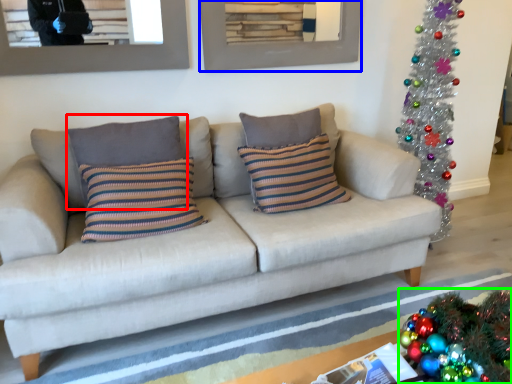
Question: Considering the real-world distances, which object is closest to pillow (highlighted by a red box)? picture frame (highlighted by a blue box) or christmas decoration (highlighted by a green box).

Choices:
 (A) picture frame
 (B) christmas decoration

Answer: (A)